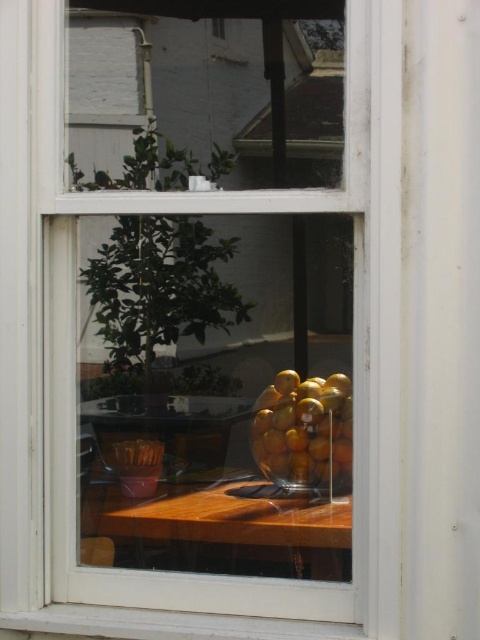
You are standing in the room and want to place a small potted plant on the wooden table at center. Is the point at coordinates point (228, 529) on the wooden table at center a suitable location for placing the plant?

The point at coordinates point (228, 529) is on the wooden table at center, so yes, it is a suitable location for placing the small potted plant.

You are a delivery robot with a 10 centimeter wide package. You need to place it on the wooden table at center without moving the shiny golden fruit at center. Is there enough space?

The distance between the wooden table at center and the shiny golden fruit at center is 12.40 centimeters. Since the package is 10 centimeters wide, there is sufficient space to place it on the wooden table at center without disturbing the shiny golden fruit at center.